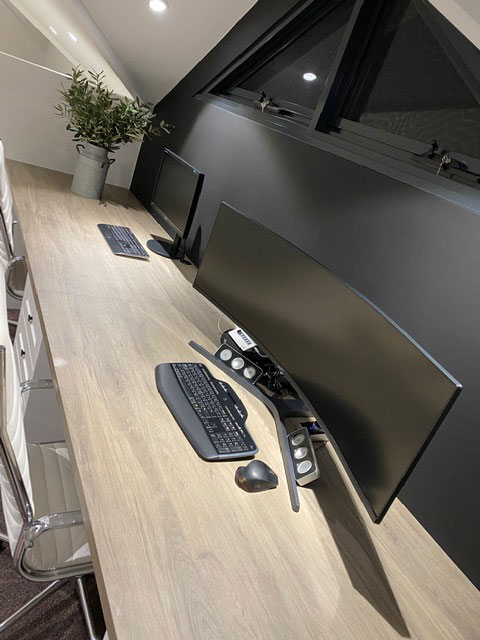
Locate an element on the screen. The height and width of the screenshot is (640, 480). leafy decoration is located at coordinates (106, 118).